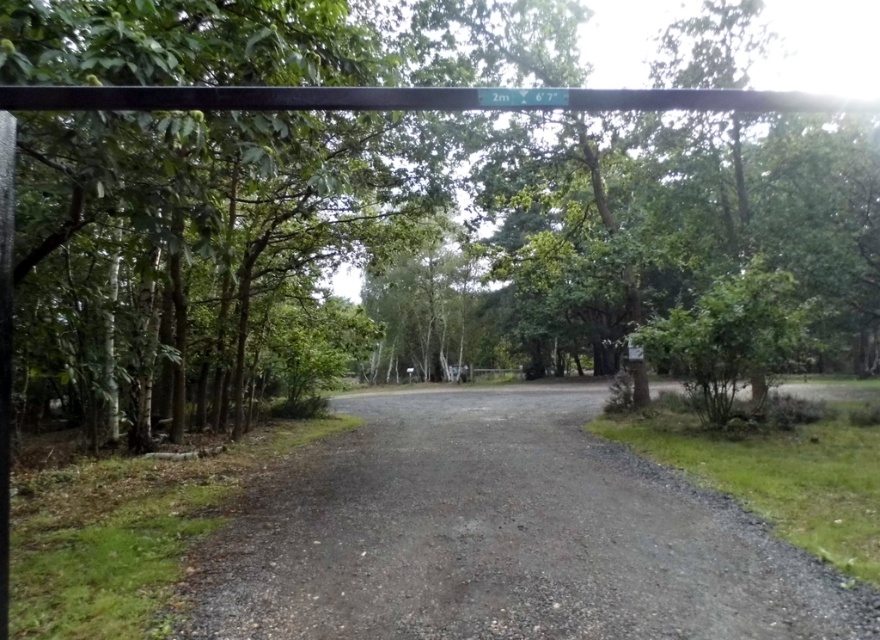
Question: Which of the following is the farthest from the observer?

Choices:
 (A) (160, 106)
 (B) (224, 86)

Answer: (B)

Question: Is green leafy tree at upper center to the right of black metal pole at upper center from the viewer's perspective?

Choices:
 (A) no
 (B) yes

Answer: (B)

Question: Can you confirm if gray gravel driveway at center is positioned below black metal pole at upper center?

Choices:
 (A) no
 (B) yes

Answer: (B)

Question: Is green leafy tree at upper center closer to the viewer compared to black metal pole at upper center?

Choices:
 (A) yes
 (B) no

Answer: (B)

Question: Among these objects, which one is nearest to the camera?

Choices:
 (A) gray gravel driveway at center
 (B) green leafy tree at upper center

Answer: (B)

Question: Which point is farther to the camera?

Choices:
 (A) (496, 99)
 (B) (440, 426)

Answer: (B)